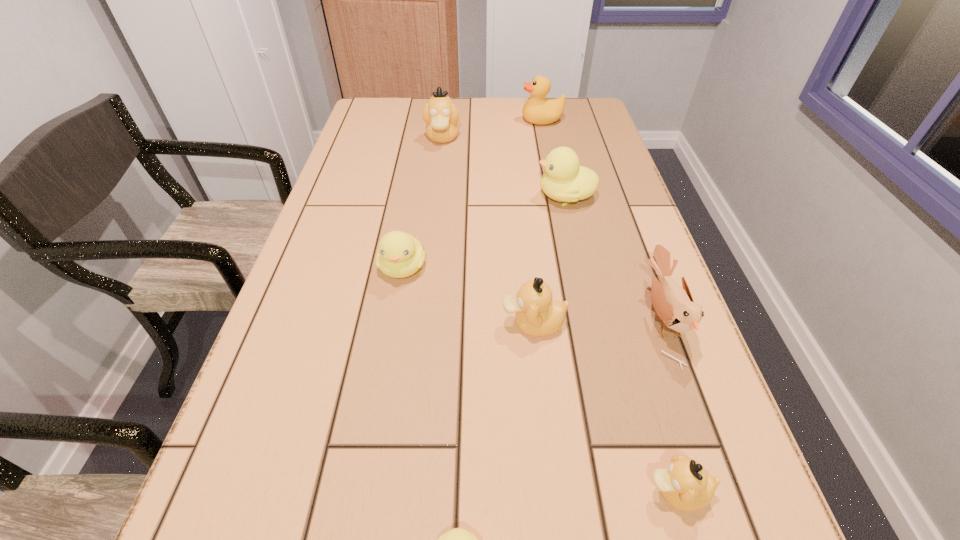
Locate an element on the screen. The height and width of the screenshot is (540, 960). duck that is at the far edge is located at coordinates (538, 110).

Where is `duck that is positioned at the right edge`? The image size is (960, 540). duck that is positioned at the right edge is located at coordinates (538, 110).

You are a GUI agent. You are given a task and a screenshot of the screen. Output one action in this format:
    pyautogui.click(x=<x>, y=<y>)
    Task: Click on the bird located at the right edge
    
    Given the screenshot: What is the action you would take?
    pyautogui.click(x=674, y=305)

Identify the location of object that is at the far right corner. This screenshot has width=960, height=540. (538, 110).

Find the location of `vacant space at the far edge of the desktop`. vacant space at the far edge of the desktop is located at coordinates (520, 107).

You are a GUI agent. You are given a task and a screenshot of the screen. Output one action in this format:
    pyautogui.click(x=<x>, y=<y>)
    Task: Click on the free space at the left edge of the desktop
    The width and height of the screenshot is (960, 540).
    Given the screenshot: What is the action you would take?
    pyautogui.click(x=401, y=140)

Find the location of a particular element. free location at the right edge is located at coordinates (624, 170).

Locate an element on the screen. Image resolution: width=960 pixels, height=540 pixels. free space at the far left corner of the desktop is located at coordinates (374, 104).

Locate an element on the screen. This screenshot has height=540, width=960. free space at the far right corner of the desktop is located at coordinates (570, 122).

Image resolution: width=960 pixels, height=540 pixels. Identify the location of unoccupied area between the bird and the second farthest tan duckling. (597, 321).